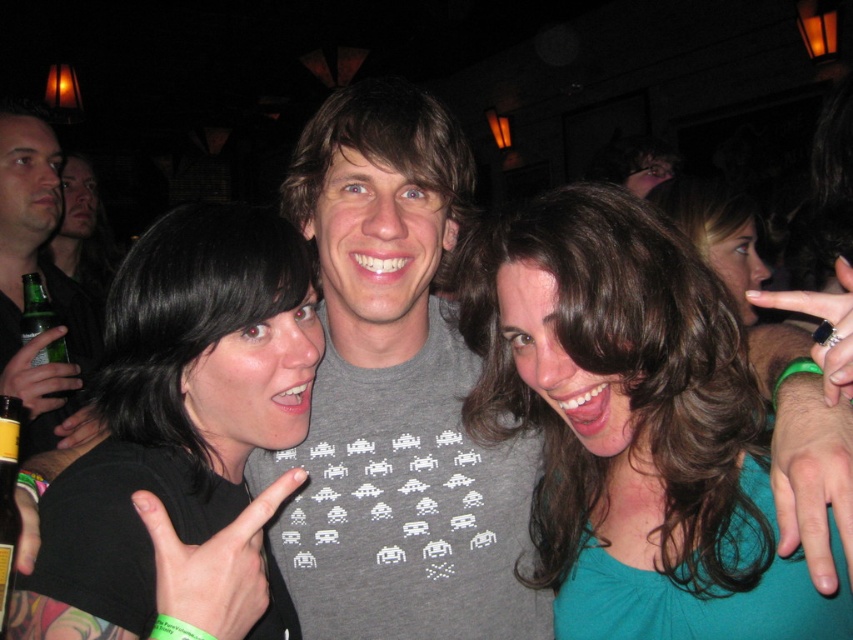
Question: Is black matte shirt at center thinner than green glass bottle at lower left?

Choices:
 (A) no
 (B) yes

Answer: (A)

Question: Does green glass bottle at lower left come in front of green glass bottle at left?

Choices:
 (A) no
 (B) yes

Answer: (B)

Question: Can you confirm if green glass bottle at lower left is positioned above green glass bottle at left?

Choices:
 (A) no
 (B) yes

Answer: (A)

Question: Which object appears farthest from the camera in this image?

Choices:
 (A) green glass bottle at lower left
 (B) black matte shirt at center

Answer: (A)

Question: Which of these objects is positioned closest to the black matte shirt at center?

Choices:
 (A) teal fabric shirt at center
 (B) green glass bottle at left
 (C) green matte bottle at left
 (D) green glass bottle at lower left

Answer: (D)

Question: Among these objects, which one is farthest from the camera?

Choices:
 (A) teal fabric shirt at center
 (B) green matte bottle at left
 (C) green glass bottle at lower left

Answer: (B)